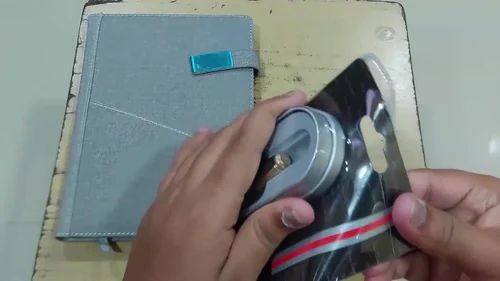
Locate an element on the screen. The width and height of the screenshot is (500, 281). pen is located at coordinates (274, 164).